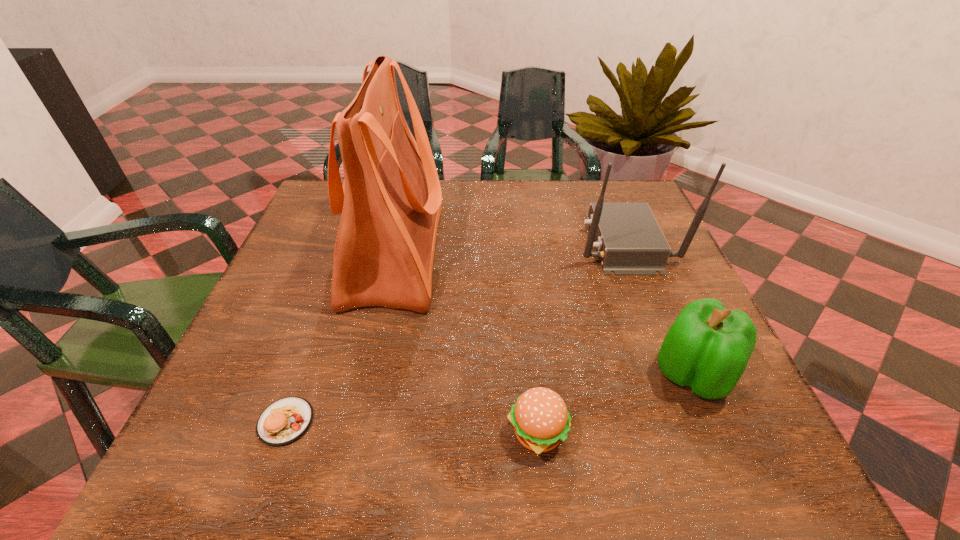
The image size is (960, 540). I want to click on free space that is in between the bell pepper and the patty, so click(x=490, y=398).

Locate an element on the screen. Image resolution: width=960 pixels, height=540 pixels. free space that is in between the router and the shortest object is located at coordinates click(x=454, y=332).

Identify the location of free point between the shortest object and the second tallest object. pyautogui.click(x=454, y=332).

At what (x,y) coordinates should I click in order to perform the action: click on empty space that is in between the second shortest object and the patty. Please return your answer as a coordinate pair (x, y). Looking at the image, I should click on (412, 428).

Locate an element on the screen. The image size is (960, 540). unoccupied area between the tallest object and the third tallest object is located at coordinates (543, 314).

You are a GUI agent. You are given a task and a screenshot of the screen. Output one action in this format:
    pyautogui.click(x=<x>, y=<y>)
    Task: Click on the vacant space in between the router and the shortest object
    This screenshot has width=960, height=540.
    Given the screenshot: What is the action you would take?
    [454, 332]

Find the location of a particular element. empty location between the third object from right to left and the router is located at coordinates (580, 338).

The width and height of the screenshot is (960, 540). I want to click on vacant space in between the third object from left to right and the router, so click(580, 338).

Locate an element on the screen. vacant region between the shopping bag and the third object from left to right is located at coordinates (466, 343).

The width and height of the screenshot is (960, 540). In order to click on object that is the fourth closest to the tallest object in this screenshot , I will do `click(707, 348)`.